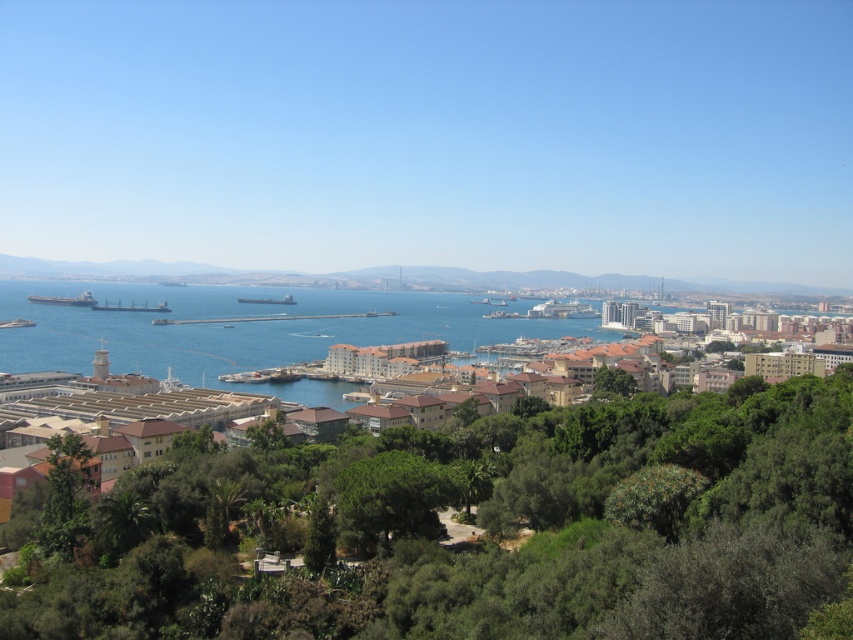
Question: Considering the real-world distances, which object is farthest from the blue water at center?

Choices:
 (A) brown textured buildings at center
 (B) green leafy tree at lower left

Answer: (B)

Question: Based on their relative distances, which object is farther from the blue water at center?

Choices:
 (A) green leafy tree at lower center
 (B) green leafy tree at lower left
 (C) brown textured buildings at center
 (D) green leafy tree at center

Answer: (A)

Question: Among these points, which one is nearest to the camera?

Choices:
 (A) (410, 481)
 (B) (360, 321)

Answer: (A)

Question: Does blue water at center appear under green leafy tree at lower center?

Choices:
 (A) yes
 (B) no

Answer: (B)

Question: Does blue water at center appear under green leafy tree at lower center?

Choices:
 (A) no
 (B) yes

Answer: (A)

Question: Can you confirm if green leafy tree at center is positioned above green leafy tree at lower center?

Choices:
 (A) yes
 (B) no

Answer: (A)